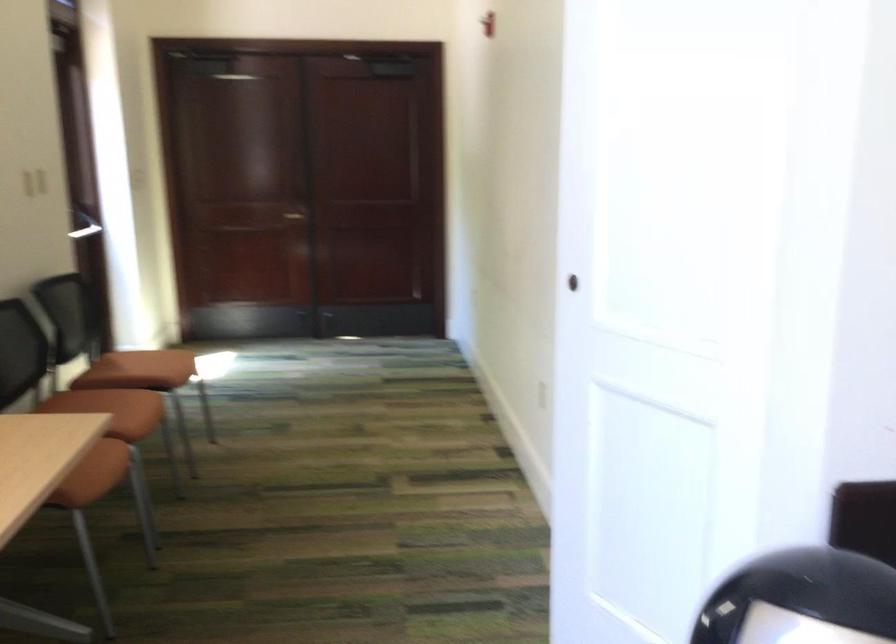
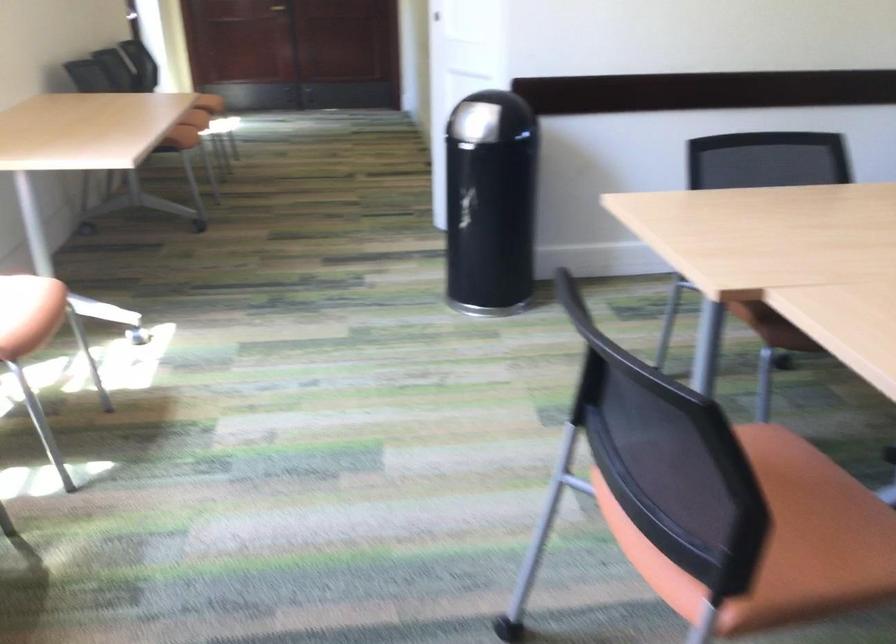
Question: I am providing you with two images of the same scene from different viewpoints. After the viewpoint changes to image2, which objects are now occluded?

Choices:
 (A) round drawer knob
 (B) trash can lid
 (C) orange chair sitting surface
 (D) light switch

Answer: (D)